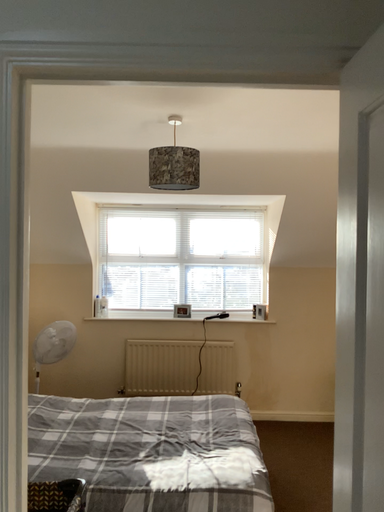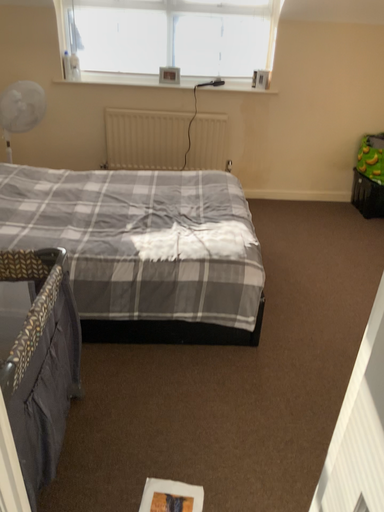
Question: Which way did the camera rotate in the video?

Choices:
 (A) rotated upward
 (B) rotated downward

Answer: (B)